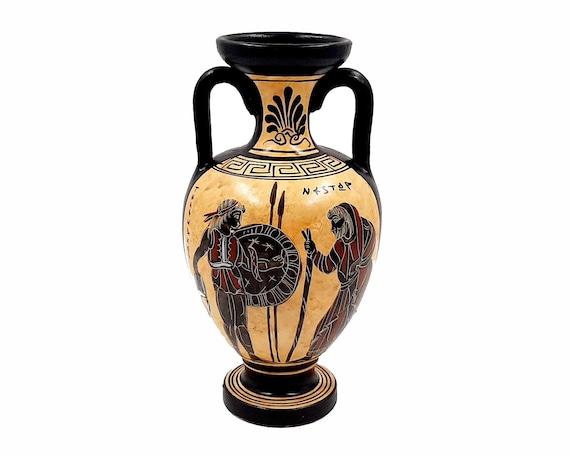
The height and width of the screenshot is (456, 570). Find the location of `right handle`. right handle is located at coordinates (364, 105).